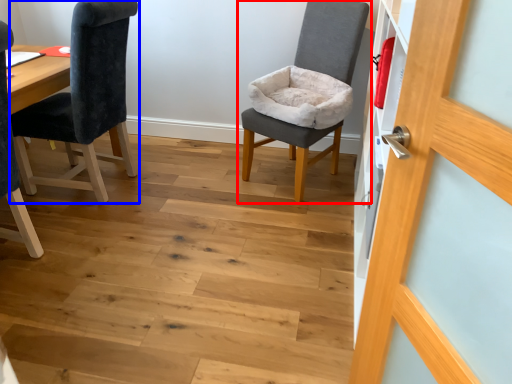
Question: Among these objects, which one is nearest to the camera, chair (highlighted by a red box) or chair (highlighted by a blue box)?

Choices:
 (A) chair
 (B) chair

Answer: (B)